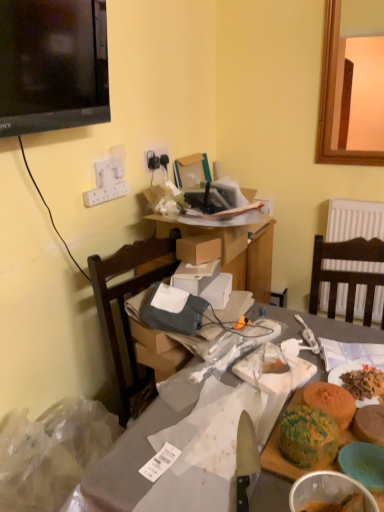
Question: Which direction should I rotate to look at matte gray table at center, placed as the second table when sorted from top to bottom, — up or down?

Choices:
 (A) down
 (B) up

Answer: (A)

Question: Does green textured cake at lower right, the first food from the right, have a larger size compared to green marbled cake at center, positioned as the 1th food in left-to-right order?

Choices:
 (A) no
 (B) yes

Answer: (A)

Question: Is green textured cake at lower right, the third food when ordered from left to right, oriented away from green marbled cake at center, positioned as the 1th food in left-to-right order?

Choices:
 (A) no
 (B) yes

Answer: (A)

Question: Is green textured cake at lower right, the third food when ordered from left to right, not within green marbled cake at center, positioned as the 1th food in left-to-right order?

Choices:
 (A) no
 (B) yes

Answer: (B)

Question: Is green textured cake at lower right, the third food when ordered from left to right, at the left side of green marbled cake at center, positioned as the 1th food in left-to-right order?

Choices:
 (A) no
 (B) yes

Answer: (A)

Question: Could you tell me if green textured cake at lower right, the first food from the right, is turned towards green marbled cake at center, the 3th food in the right-to-left sequence?

Choices:
 (A) no
 (B) yes

Answer: (A)

Question: Is green textured cake at lower right, the first food from the right, thinner than green marbled cake at center, positioned as the 1th food in left-to-right order?

Choices:
 (A) yes
 (B) no

Answer: (A)

Question: Is green textured cake at lower right, which appears as the 2th food when viewed from the left, outside of cardboard boxes at center, the 2th table positioned from the bottom?

Choices:
 (A) no
 (B) yes

Answer: (B)

Question: Is green textured cake at lower right, which appears as the 2th food when viewed from the right, at the left side of cardboard boxes at center, the 2th table positioned from the bottom?

Choices:
 (A) no
 (B) yes

Answer: (A)

Question: Does green textured cake at lower right, which appears as the 2th food when viewed from the right, have a lesser width compared to cardboard boxes at center, the 2th table positioned from the bottom?

Choices:
 (A) no
 (B) yes

Answer: (B)

Question: Does green textured cake at lower right, which appears as the 2th food when viewed from the left, have a smaller size compared to cardboard boxes at center, the 2th table positioned from the bottom?

Choices:
 (A) yes
 (B) no

Answer: (A)

Question: Is green textured cake at lower right, which appears as the 2th food when viewed from the right, positioned with its back to cardboard boxes at center, placed as the 1th table when sorted from top to bottom?

Choices:
 (A) no
 (B) yes

Answer: (A)

Question: Is green textured cake at lower right, which appears as the 2th food when viewed from the right, to the right of cardboard boxes at center, placed as the 1th table when sorted from top to bottom, from the viewer's perspective?

Choices:
 (A) no
 (B) yes

Answer: (B)

Question: From the image's perspective, is shiny silver knife at center below green marbled cake at center, positioned as the 1th food in left-to-right order?

Choices:
 (A) yes
 (B) no

Answer: (A)